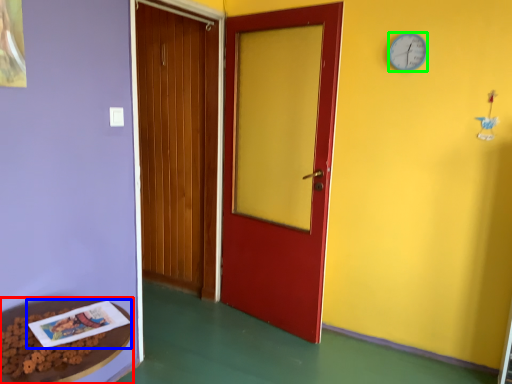
Question: Considering the real-world distances, which object is closest to table (highlighted by a red box)? book (highlighted by a blue box) or clock (highlighted by a green box).

Choices:
 (A) book
 (B) clock

Answer: (A)